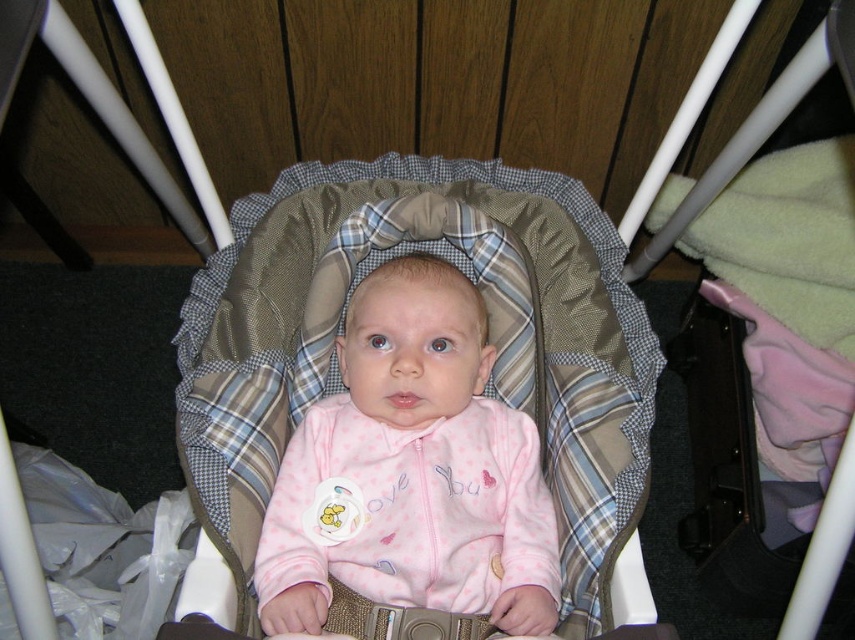
Question: Is plaid fabric infant bed at center further to the viewer compared to pink fleece baby at center?

Choices:
 (A) yes
 (B) no

Answer: (B)

Question: Which point is farther from the camera taking this photo?

Choices:
 (A) (282, 195)
 (B) (269, 621)

Answer: (A)

Question: Which point is closer to the camera?

Choices:
 (A) (387, 310)
 (B) (606, 570)

Answer: (B)

Question: Which point is closer to the camera taking this photo?

Choices:
 (A) (295, 218)
 (B) (526, 512)

Answer: (B)

Question: Is plaid fabric infant bed at center positioned in front of pink fleece baby at center?

Choices:
 (A) yes
 (B) no

Answer: (A)

Question: Can you confirm if plaid fabric infant bed at center is smaller than pink fleece baby at center?

Choices:
 (A) yes
 (B) no

Answer: (B)